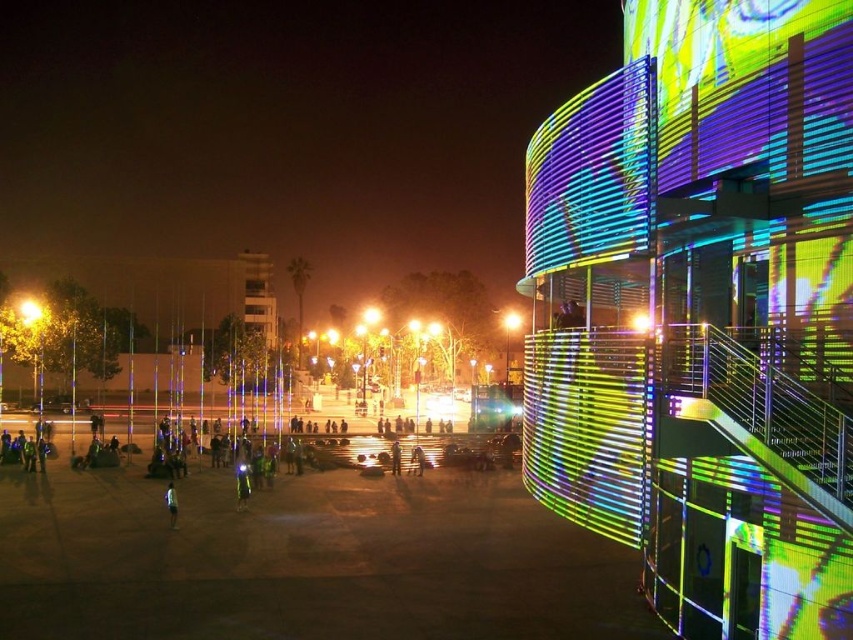
Can you confirm if light blue fabric pants at lower center is positioned to the left of yellow metallic streetlight at center?

Yes, light blue fabric pants at lower center is to the left of yellow metallic streetlight at center.

Find the location of a particular element. light blue fabric pants at lower center is located at coordinates (242, 484).

Where is `light blue fabric pants at lower center`? This screenshot has height=640, width=853. light blue fabric pants at lower center is located at coordinates (242, 484).

Is light brown fabric pants at lower left in front of yellow metallic streetlight at center?

Yes, it is.

Does point (164, 492) come closer to viewer compared to point (509, 316)?

Yes, it is in front of point (509, 316).

Is point (173, 516) farther from camera compared to point (518, 316)?

No, (173, 516) is in front of (518, 316).

Where is `light brown fabric pants at lower left`? This screenshot has width=853, height=640. light brown fabric pants at lower left is located at coordinates (171, 504).

Which is above, bright yellow light at center or light brown fabric pants at lower left?

bright yellow light at center is above.

Is bright yellow light at center shorter than light brown fabric pants at lower left?

Indeed, bright yellow light at center has a lesser height compared to light brown fabric pants at lower left.

The width and height of the screenshot is (853, 640). What do you see at coordinates (28, 310) in the screenshot?
I see `bright yellow light at center` at bounding box center [28, 310].

The width and height of the screenshot is (853, 640). Find the location of `bright yellow light at center`. bright yellow light at center is located at coordinates (28, 310).